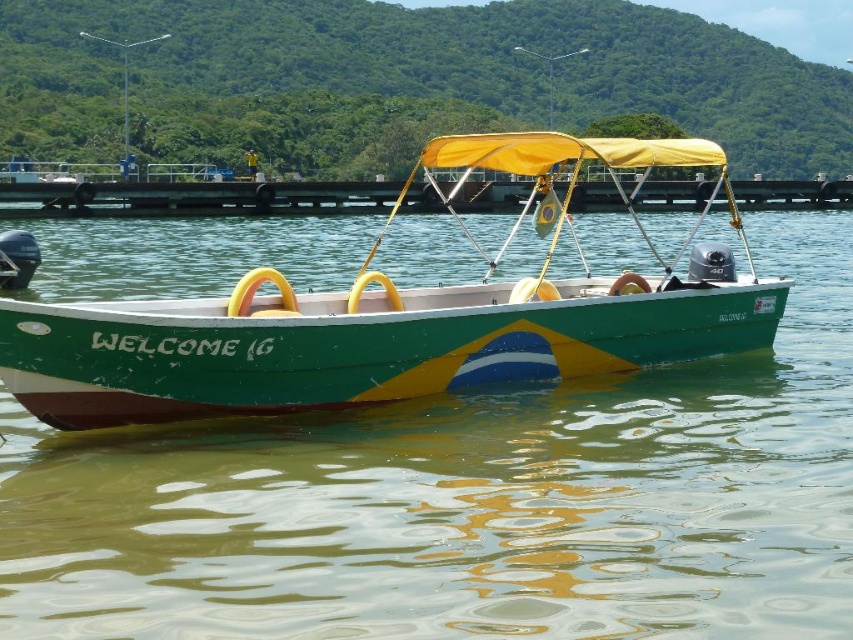
You are a photographer trying to capture the two points on the boat. Which point, point (491, 301) or point (734, 180), appears larger in your photo?

Point (491, 301) appears larger in the photo because it is closer to the camera than point (734, 180).

You are a tour guide preparing to board passengers onto the green matte boat at center. The dock is the smooth concrete dock at center. Since the boat is elevated, what might you need to adjust to help passengers board safely?

The green matte boat at center is much taller than the smooth concrete dock at center, so you might need to use a boarding ramp or steps to bridge the height difference and ensure safe access for passengers.